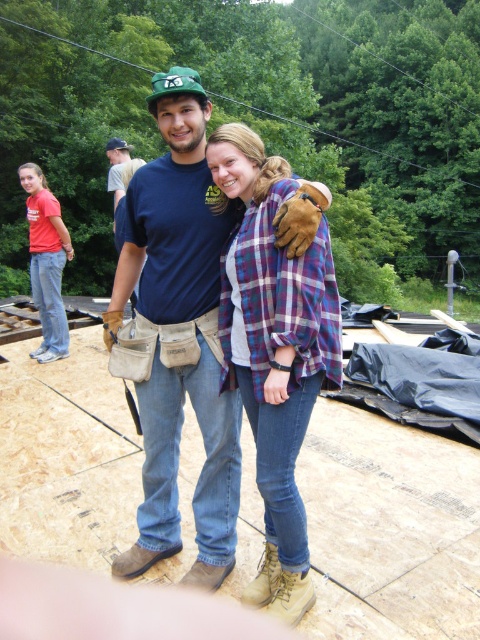
Question: Is brown leather boots at center below blue fabric shirt at center?

Choices:
 (A) no
 (B) yes

Answer: (B)

Question: Which point is farther to the camera?

Choices:
 (A) (118, 186)
 (B) (276, 241)
 (C) (54, 246)

Answer: (A)

Question: Is brown leather boots at center in front of matte red t-shirt at left?

Choices:
 (A) no
 (B) yes

Answer: (B)

Question: Which point is farther to the camera?

Choices:
 (A) brown leather boots at center
 (B) plaid fabric shirt at center

Answer: (A)

Question: Considering the relative positions of brown leather boots at center and blue fabric shirt at center in the image provided, where is brown leather boots at center located with respect to blue fabric shirt at center?

Choices:
 (A) left
 (B) right

Answer: (B)

Question: Among these points, which one is nearest to the camera?

Choices:
 (A) (291, 573)
 (B) (60, 221)
 (C) (203, 157)

Answer: (A)